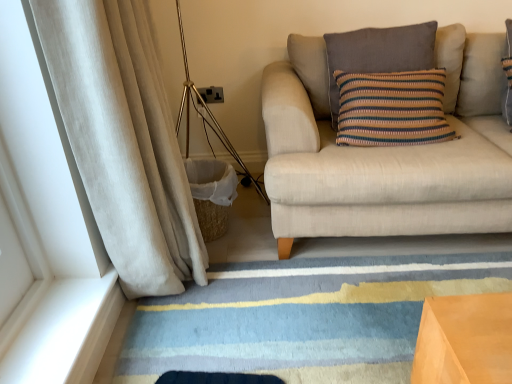
You are a GUI agent. You are given a task and a screenshot of the screen. Output one action in this format:
    pyautogui.click(x=<x>, y=<y>)
    Task: Click on the empty space that is to the right of beige corduroy curtain at left
    
    Given the screenshot: What is the action you would take?
    (x=276, y=281)